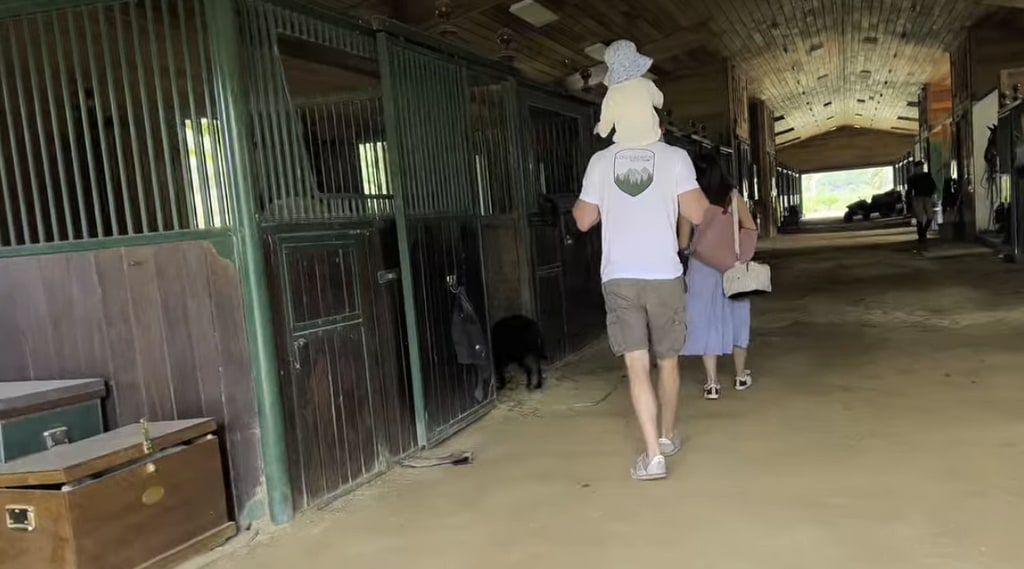
Where is `ceiling`? ceiling is located at coordinates (783, 38), (904, 65), (830, 118).